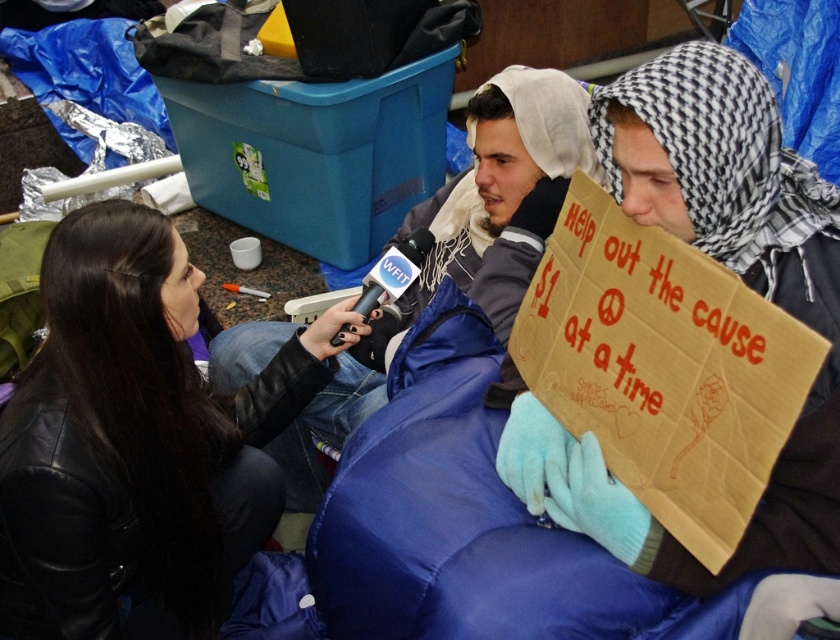
You are a photographer standing at the camera position. You want to take a closeup shot of the point at coordinate point (x=134, y=499) and point (x=529, y=148). Which point should you focus on first to ensure it is in sharp focus?

Point (x=134, y=499) is closer to the camera than point (x=529, y=148). Therefore, to ensure the point at (x=134, y=499) is in sharp focus, you should focus on it first before adjusting for the other point.

You are a photographer trying to capture a candid shot of both the black leather jacket at lower left and the blue puffy jacket at center. Based on their heights, which jacket should you focus on first to ensure both are in frame?

The black leather jacket at lower left is shorter than the blue puffy jacket at center. To ensure both are in frame, focus on the taller blue puffy jacket at center first, then adjust to include the shorter black leather jacket at lower left.

You are a photographer at the interview scene. You need to adjust the camera angle so that both the black leather jacket at lower left and the blue puffy jacket at center are in the frame. Which direction should you tilt the camera to include both?

You should tilt the camera upward because the black leather jacket at lower left is located below the blue puffy jacket at center, so tilting upward will ensure both are visible in the frame.